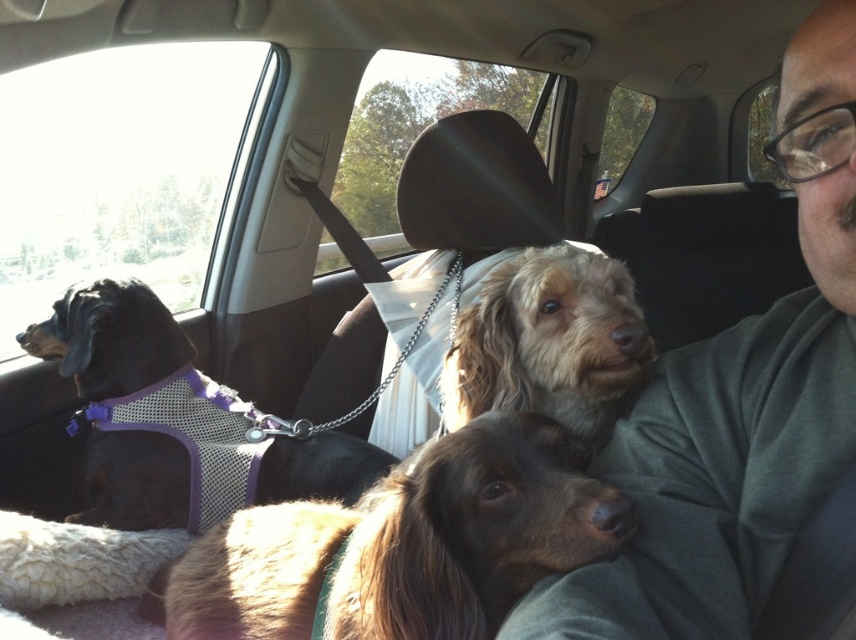
Question: Among these points, which one is nearest to the camera?

Choices:
 (A) (797, 58)
 (B) (623, 369)

Answer: (A)

Question: Where is brown fur dog at center located in relation to black mesh vest at left in the image?

Choices:
 (A) below
 (B) above

Answer: (B)

Question: Which is nearer to the fuzzy brown dog at center?

Choices:
 (A) black mesh vest at left
 (B) brown fur dog at center

Answer: (B)

Question: Which point is farther from the camera taking this photo?

Choices:
 (A) (120, 349)
 (B) (491, 486)
 (C) (849, 164)
 (D) (495, 324)

Answer: (A)

Question: Where is gray cotton shirt at center located in relation to brown fur dog at center in the image?

Choices:
 (A) below
 (B) above

Answer: (B)

Question: Can you confirm if brown fur dog at center is positioned to the left of fuzzy brown dog at center?

Choices:
 (A) yes
 (B) no

Answer: (A)